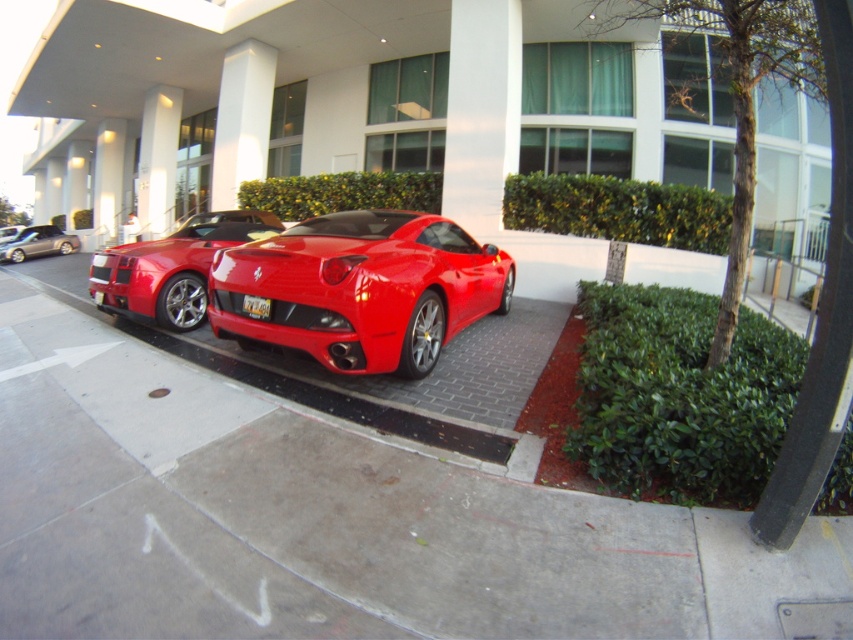
You are a delivery person trying to park a new car that is 1.8 meters wide. You see the glossy concrete curb at lower center and the silver metallic sedan at left. Can the new car fit between them?

The glossy concrete curb at lower center is wider than the silver metallic sedan at left. Since the car is 1.8 meters wide, it depends on the actual width of the curb and sedan. However, since the curb is wider, there might be enough space. But without exact measurements, we can only say that the curb is wider, so possibly yes.

You are standing in front of the modern building with two red sports cars parked side by side. There is a point marked at coordinates (480,112). What object does this point represent?

The point at coordinates (480,112) represents the white smooth pillar at center.

You are a delivery person trying to park a 2.5 meters long truck between the two red sports cars. Can you fit the truck between the glossy red sports car at center and the shiny red sports car at center?

The glossy red sports car at center and the shiny red sports car at center are 2.23 meters apart. Since the truck is 2.5 meters long, it cannot fit between them as the space is shorter than the truck.